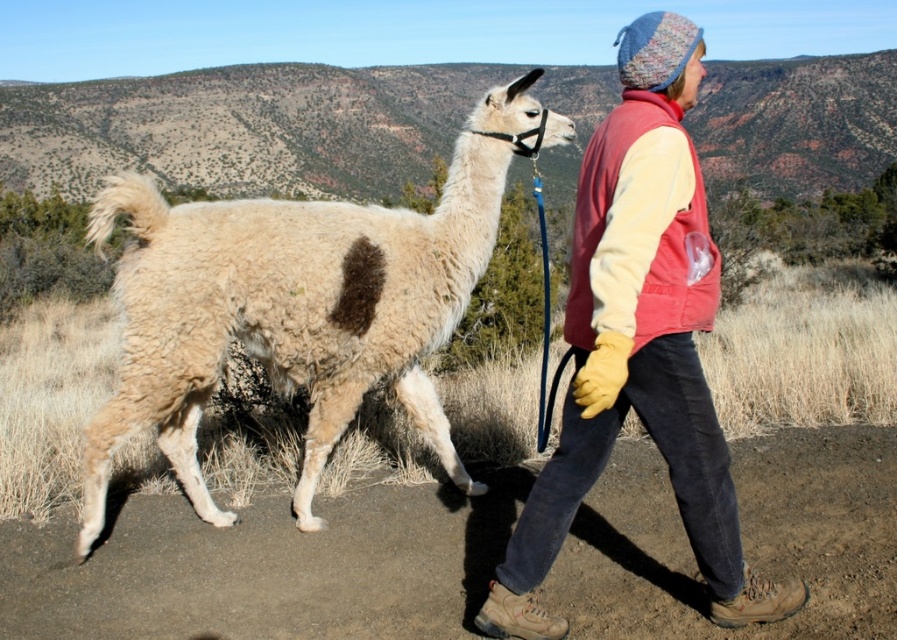
You are a photographer trying to capture the white woolen alpaca at center and the knitted wool hat at upper right in the same frame. Which object should you focus on first if you want to ensure both are in focus without moving the camera?

The white woolen alpaca at center should be focused on first because it has a lesser width than the knitted wool hat at upper right, so adjusting focus to the closer object ensures both are in focus.

Consider the image. You are standing in an outdoor area and see the white woolen alpaca at center. If you want to approach it without getting too close, what is the minimum distance you should maintain?

The minimum distance you should maintain is 3.60 meters, as the white woolen alpaca at center is currently 3.60 meters away from you.

You are an animal trainer who needs to fit both the white woolen alpaca at center and the knitted wool hat at upper right into a small transport box. Based on their sizes, which item should you prioritize placing first into the box?

The white woolen alpaca at center occupies less space than the knitted wool hat at upper right, so you should prioritize placing the knitted wool hat at upper right first to ensure it fits properly before the larger item takes up space.